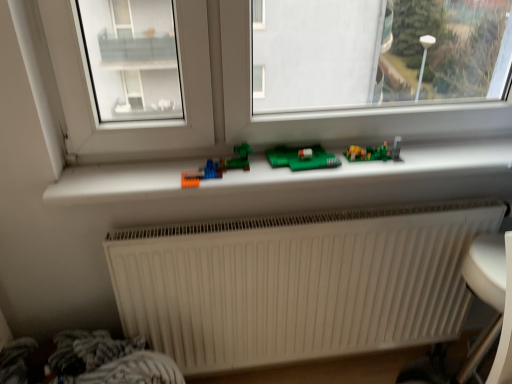
What do you see at coordinates (297, 283) in the screenshot? I see `white ribbed radiator at lower center` at bounding box center [297, 283].

Measure the distance between translucent plastic toy at center, acting as the first toy starting from the left, and camera.

translucent plastic toy at center, acting as the first toy starting from the left, is 3.68 feet away from camera.

The image size is (512, 384). What do you see at coordinates (480, 299) in the screenshot? I see `white plastic armchair at lower right` at bounding box center [480, 299].

The height and width of the screenshot is (384, 512). Find the location of `white plastic window sill at center`. white plastic window sill at center is located at coordinates (305, 179).

Is translucent plastic toy at center, which ranks as the 2th toy in back-to-front order, with matte plastic toy at center, the 1th toy in the back-to-front sequence?

No, translucent plastic toy at center, which ranks as the 2th toy in back-to-front order, is not with matte plastic toy at center, the 1th toy in the back-to-front sequence.

Is translucent plastic toy at center, which ranks as the 2th toy in back-to-front order, spatially inside matte plastic toy at center, which is the 1th toy from right to left, or outside of it?

translucent plastic toy at center, which ranks as the 2th toy in back-to-front order, lies outside matte plastic toy at center, which is the 1th toy from right to left.

Would you say translucent plastic toy at center, which appears as the 1th toy when viewed from the front, is to the left or to the right of matte plastic toy at center, which is the 1th toy from right to left, in the picture?

Based on their positions, translucent plastic toy at center, which appears as the 1th toy when viewed from the front, is located to the left of matte plastic toy at center, which is the 1th toy from right to left.

What are the coordinates of `toy below the matte plastic toy at center, acting as the second toy starting from the front (from the image's perspective)` in the screenshot? It's located at [x=218, y=167].

Considering the points (375, 198) and (419, 381), which point is behind, point (375, 198) or point (419, 381)?

The point (419, 381) is more distant.

Would you say white plastic window sill at center is a long distance from white plastic armchair at lower right?

white plastic window sill at center is near white plastic armchair at lower right, not far away.

Can you confirm if white ribbed radiator at lower center is positioned to the right of white plastic armchair at lower right?

In fact, white ribbed radiator at lower center is to the left of white plastic armchair at lower right.

From the image's perspective, which object appears higher, white ribbed radiator at lower center or white plastic armchair at lower right?

white ribbed radiator at lower center is shown above in the image.

Which is in front, point (147, 335) or point (499, 299)?

The point (499, 299) is closer.

From the image's perspective, is matte plastic toy at center, the 1th toy in the back-to-front sequence, above or below white plastic armchair at lower right?

matte plastic toy at center, the 1th toy in the back-to-front sequence, is above white plastic armchair at lower right.

How different are the orientations of matte plastic toy at center, acting as the second toy starting from the front, and white plastic armchair at lower right in degrees?

The angle between the facing direction of matte plastic toy at center, acting as the second toy starting from the front, and the facing direction of white plastic armchair at lower right is 86.2 degrees.

Is point (369, 150) less distant than point (509, 373)?

No, (369, 150) is further to viewer.

From a real-world perspective, which is physically below, matte plastic toy at center, the 1th toy in the back-to-front sequence, or white plastic armchair at lower right?

From a 3D spatial view, white plastic armchair at lower right is below.

Is white plastic window sill at center next to translucent plastic toy at center, which appears as the 1th toy when viewed from the front?

No, white plastic window sill at center is not next to translucent plastic toy at center, which appears as the 1th toy when viewed from the front.

Consider the image. Does white plastic window sill at center have a smaller size compared to translucent plastic toy at center, the 2th toy from the right?

No.

Considering the relative sizes of white plastic window sill at center and translucent plastic toy at center, which ranks as the 2th toy in back-to-front order, in the image provided, is white plastic window sill at center wider than translucent plastic toy at center, which ranks as the 2th toy in back-to-front order,?

Indeed, white plastic window sill at center has a greater width compared to translucent plastic toy at center, which ranks as the 2th toy in back-to-front order.

Is white plastic window sill at center inside the boundaries of translucent plastic toy at center, which appears as the 1th toy when viewed from the front, or outside?

white plastic window sill at center is not inside translucent plastic toy at center, which appears as the 1th toy when viewed from the front, it's outside.

Between white plastic armchair at lower right and white ribbed radiator at lower center, which one has more height?

white plastic armchair at lower right.

Where is `radiator behind the white plastic armchair at lower right`? The image size is (512, 384). radiator behind the white plastic armchair at lower right is located at coordinates (297, 283).

Considering the positions of objects white plastic armchair at lower right and white ribbed radiator at lower center in the image provided, who is more to the right, white plastic armchair at lower right or white ribbed radiator at lower center?

From the viewer's perspective, white plastic armchair at lower right appears more on the right side.

From a real-world perspective, which object stands above the other?

white ribbed radiator at lower center, from a real-world perspective.

From the image's perspective, who appears lower, white ribbed radiator at lower center or white plastic window sill at center?

white ribbed radiator at lower center appears lower in the image.

From a real-world perspective, which is physically above, white ribbed radiator at lower center or white plastic window sill at center?

From a 3D spatial view, white plastic window sill at center is above.

Is white ribbed radiator at lower center further to camera compared to white plastic window sill at center?

Yes, white ribbed radiator at lower center is behind white plastic window sill at center.

In the scene shown: Is white ribbed radiator at lower center aimed at white plastic window sill at center?

No, white ribbed radiator at lower center is not turned towards white plastic window sill at center.

What are the coordinates of `toy below the matte plastic toy at center, the 1th toy in the back-to-front sequence (from the image's perspective)` in the screenshot? It's located at (218, 167).

You are a GUI agent. You are given a task and a screenshot of the screen. Output one action in this format:
    pyautogui.click(x=<x>, y=<y>)
    Task: Click on the armchair lying on the right of white plastic window sill at center
    
    Given the screenshot: What is the action you would take?
    pyautogui.click(x=480, y=299)

When comparing their distances from matte plastic toy at center, which is the 1th toy from right to left, does white plastic armchair at lower right or white ribbed radiator at lower center seem closer?

Among the two, white plastic armchair at lower right is located nearer to matte plastic toy at center, which is the 1th toy from right to left.

From the image, which object appears to be farther from white plastic armchair at lower right, white ribbed radiator at lower center or matte plastic toy at center, the 1th toy in the back-to-front sequence?

white ribbed radiator at lower center lies further to white plastic armchair at lower right than the other object.

From the image, which object appears to be farther from white ribbed radiator at lower center, white plastic window sill at center or translucent plastic toy at center, acting as the first toy starting from the left?

translucent plastic toy at center, acting as the first toy starting from the left.

Considering their positions, is translucent plastic toy at center, the 2th toy from the right, positioned further to white ribbed radiator at lower center than matte plastic toy at center, acting as the second toy starting from the front?

translucent plastic toy at center, the 2th toy from the right, is further to white ribbed radiator at lower center.

Which object lies nearer to the anchor point white plastic armchair at lower right, translucent plastic toy at center, the 2th toy from the right, or white ribbed radiator at lower center?

Based on the image, white ribbed radiator at lower center appears to be nearer to white plastic armchair at lower right.

Considering their positions, is matte plastic toy at center, marked as the 2th toy in a left-to-right arrangement, positioned further to translucent plastic toy at center, the 2th toy from the right, than white plastic armchair at lower right?

Based on the image, white plastic armchair at lower right appears to be further to translucent plastic toy at center, the 2th toy from the right.

Estimate the real-world distances between objects in this image. Which object is closer to white plastic armchair at lower right, white ribbed radiator at lower center or translucent plastic toy at center, which ranks as the 2th toy in back-to-front order?

Based on the image, white ribbed radiator at lower center appears to be nearer to white plastic armchair at lower right.

Estimate the real-world distances between objects in this image. Which object is closer to white plastic armchair at lower right, white plastic window sill at center or white ribbed radiator at lower center?

white ribbed radiator at lower center lies closer to white plastic armchair at lower right than the other object.

Find the location of a particular element. window sill situated between translucent plastic toy at center, acting as the first toy starting from the left, and white plastic armchair at lower right from left to right is located at coordinates (305, 179).

Where is `toy between matte plastic toy at center, the 1th toy in the back-to-front sequence, and white ribbed radiator at lower center from top to bottom`? The height and width of the screenshot is (384, 512). toy between matte plastic toy at center, the 1th toy in the back-to-front sequence, and white ribbed radiator at lower center from top to bottom is located at coordinates (218, 167).

Where is `window sill situated between white ribbed radiator at lower center and white plastic armchair at lower right from left to right`? This screenshot has height=384, width=512. window sill situated between white ribbed radiator at lower center and white plastic armchair at lower right from left to right is located at coordinates [305, 179].

This screenshot has width=512, height=384. I want to click on radiator between translucent plastic toy at center, the 2th toy from the right, and white plastic armchair at lower right, in the horizontal direction, so click(x=297, y=283).